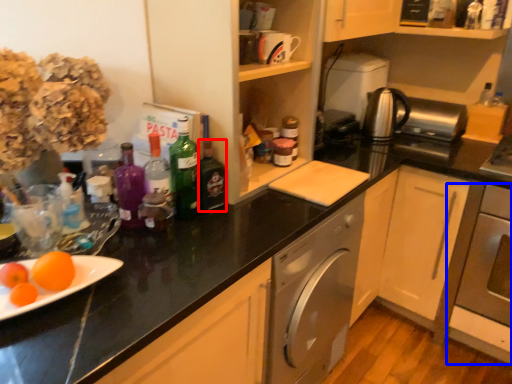
Question: Which object is further to the camera taking this photo, bottle (highlighted by a red box) or oven (highlighted by a blue box)?

Choices:
 (A) bottle
 (B) oven

Answer: (B)